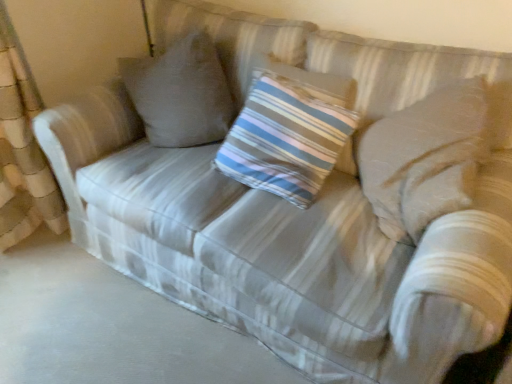
Measure the distance between striped fabric pillow at center and camera.

striped fabric pillow at center is 1.46 meters from camera.

What do you see at coordinates (286, 137) in the screenshot? Image resolution: width=512 pixels, height=384 pixels. I see `striped fabric pillow at center` at bounding box center [286, 137].

The image size is (512, 384). I want to click on striped fabric pillow at center, so click(x=286, y=137).

Locate an element on the screen. striped fabric pillow at center is located at coordinates (286, 137).